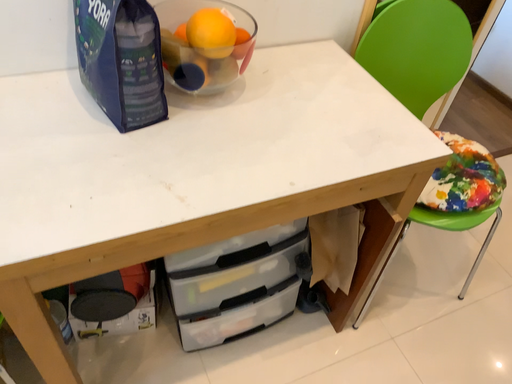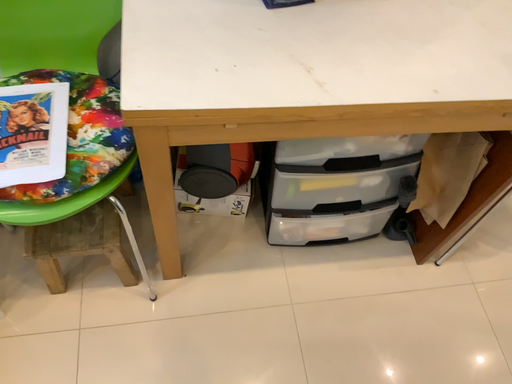
Question: How did the camera likely rotate when shooting the video?

Choices:
 (A) rotated upward
 (B) rotated downward

Answer: (B)